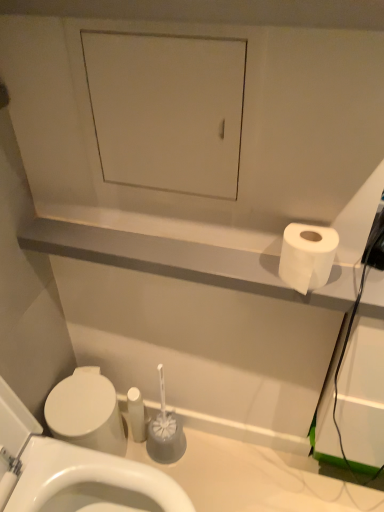
Question: From the image's perspective, does white matte cabinet at upper center appear lower than white matte toilet paper at right?

Choices:
 (A) yes
 (B) no

Answer: (B)

Question: Is white matte cabinet at upper center positioned with its back to white matte toilet paper at right?

Choices:
 (A) no
 (B) yes

Answer: (A)

Question: Could you tell me if white matte cabinet at upper center is facing white matte toilet paper at right?

Choices:
 (A) no
 (B) yes

Answer: (A)

Question: Considering the relative sizes of white matte cabinet at upper center and white matte toilet paper at right in the image provided, is white matte cabinet at upper center wider than white matte toilet paper at right?

Choices:
 (A) yes
 (B) no

Answer: (B)

Question: Is there a large distance between white matte cabinet at upper center and white matte toilet paper at right?

Choices:
 (A) no
 (B) yes

Answer: (A)

Question: Does white matte cabinet at upper center have a lesser height compared to white matte toilet paper at right?

Choices:
 (A) yes
 (B) no

Answer: (B)

Question: Is white glossy toilet at lower left not within white matte toilet paper at right?

Choices:
 (A) yes
 (B) no

Answer: (A)

Question: From the image's perspective, is white glossy toilet at lower left on white matte toilet paper at right?

Choices:
 (A) no
 (B) yes

Answer: (A)

Question: Would you consider white glossy toilet at lower left to be distant from white matte toilet paper at right?

Choices:
 (A) yes
 (B) no

Answer: (B)

Question: Does white glossy toilet at lower left come in front of white matte toilet paper at right?

Choices:
 (A) no
 (B) yes

Answer: (B)

Question: Does white glossy toilet at lower left lie behind white matte toilet paper at right?

Choices:
 (A) yes
 (B) no

Answer: (B)

Question: Considering the relative positions of white glossy toilet at lower left and white matte toilet paper at right in the image provided, is white glossy toilet at lower left to the left of white matte toilet paper at right from the viewer's perspective?

Choices:
 (A) no
 (B) yes

Answer: (B)

Question: Can you confirm if white matte cabinet at upper center is taller than white glossy toilet at lower left?

Choices:
 (A) no
 (B) yes

Answer: (A)